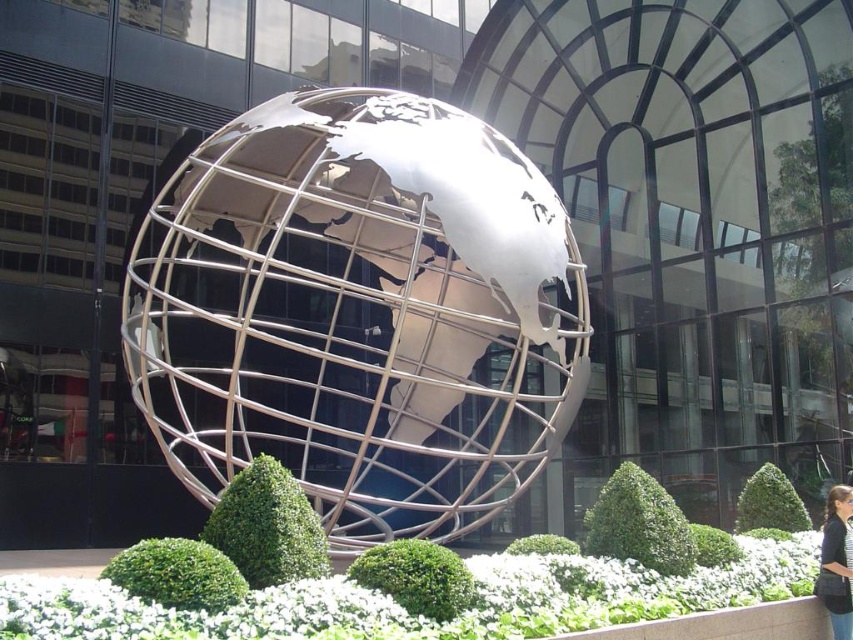
You are a photographer trying to capture the metallic silver globe at center and the black fabric hair at lower right in a single frame. Based on their sizes, which object should you focus on to ensure both are clearly visible without zooming in or out?

The metallic silver globe at center is wider than the black fabric hair at lower right. To capture both clearly in a single frame without zooming, focus on the metallic silver globe at center since it occupies more space in the scene.

You are an architect evaluating the outdoor space in front of the modern glass building. You notice the metallic silver globe at center and the black fabric hair at lower right. Which object would cast a longer shadow at noon given their sizes and positions?

The metallic silver globe at center has a larger size compared to the black fabric hair at lower right, so it would cast a longer shadow at noon.

You are standing in front of the metallic globe sculpture and want to determine which of the two points, point (312, 433) or point (828, 602), is closer to you. Based on the scene, which point is nearer?

Point (312, 433) is closer to you than point (828, 602) because it is further to the viewer in the image.